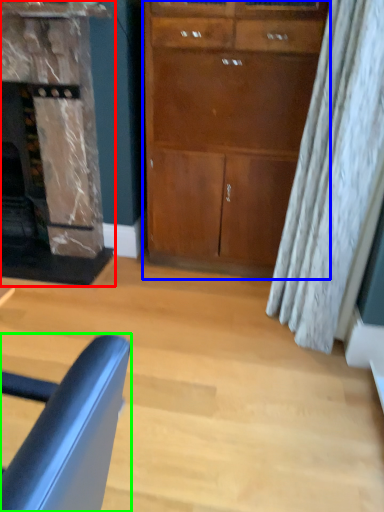
Question: Considering the real-world distances, which object is farthest from fireplace (highlighted by a red box)? cabinetry (highlighted by a blue box) or chair (highlighted by a green box)?

Choices:
 (A) cabinetry
 (B) chair

Answer: (B)